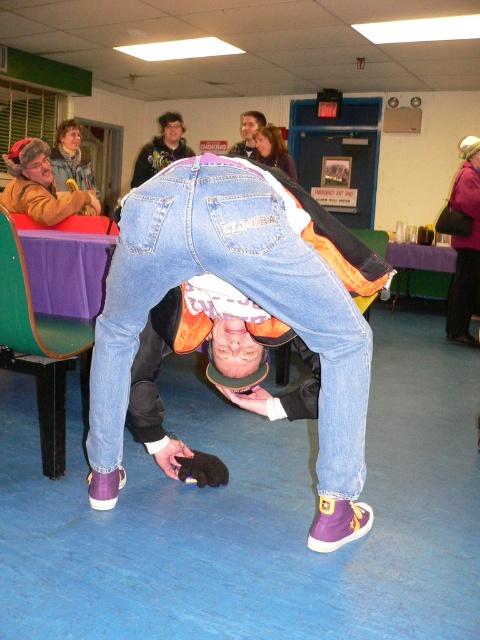
Question: Does denim jeans at center have a lesser width compared to dark brown hoodie at upper center?

Choices:
 (A) yes
 (B) no

Answer: (B)

Question: Which object is closer to the camera taking this photo?

Choices:
 (A) denim jeans at center
 (B) dark brown hoodie at upper center

Answer: (A)

Question: Can you confirm if denim jeans at center is bigger than dark brown hoodie at upper center?

Choices:
 (A) yes
 (B) no

Answer: (A)

Question: Which of the following is the closest to the observer?

Choices:
 (A) (139, 172)
 (B) (311, 339)

Answer: (B)

Question: Which object is closer to the camera taking this photo?

Choices:
 (A) dark brown hoodie at upper center
 (B) denim jeans at center

Answer: (B)

Question: Is denim jeans at center wider than dark brown hoodie at upper center?

Choices:
 (A) no
 (B) yes

Answer: (B)